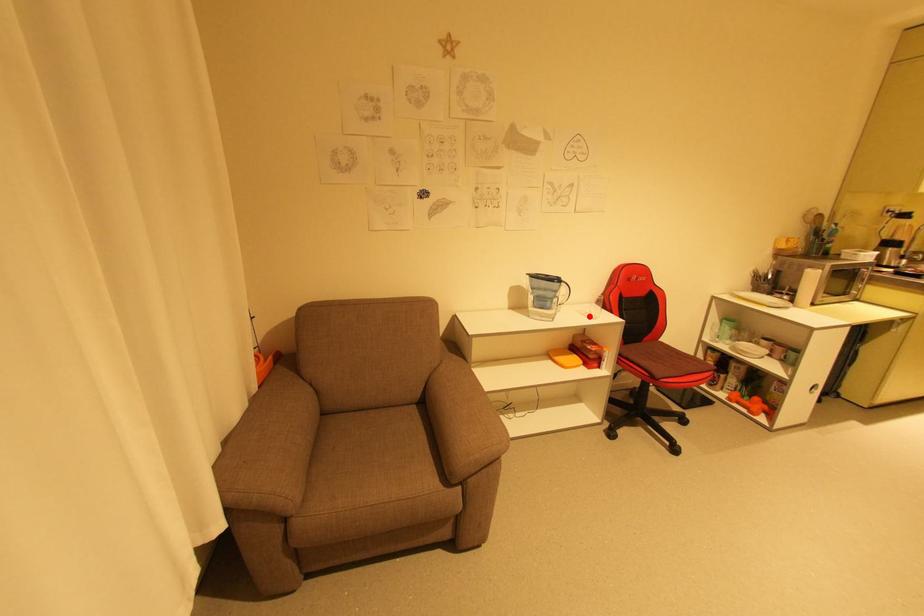
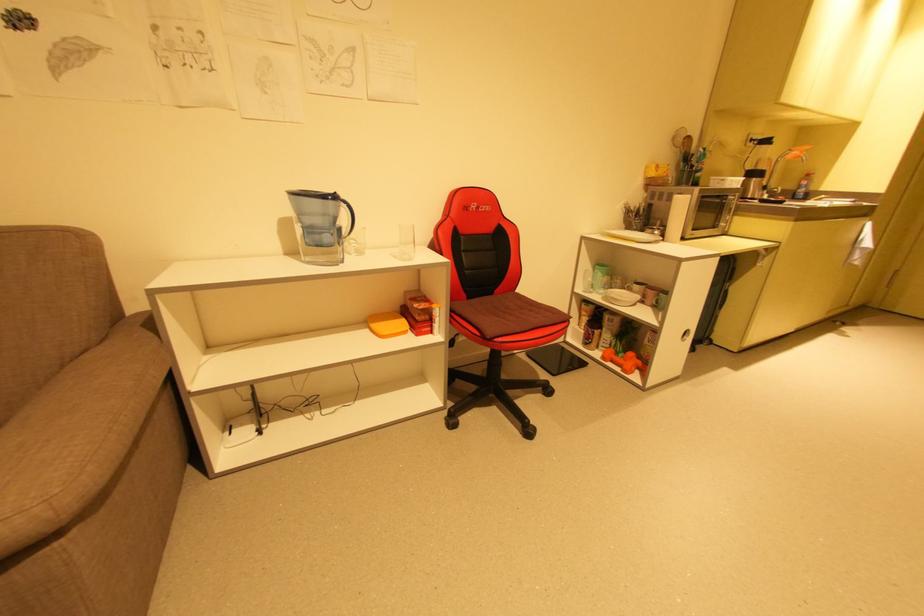
Find the pixel in the second image that matches the highlighted location in the first image.

(400, 257)